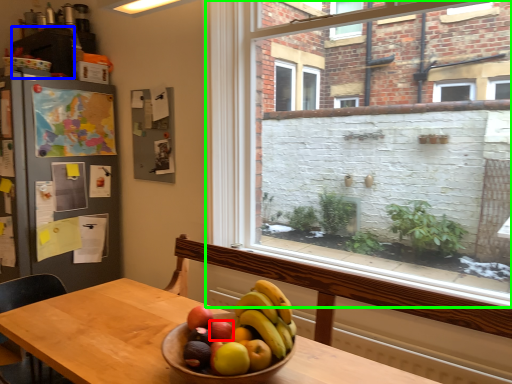
Question: Based on their relative distances, which object is farther from apple (highlighted by a red box)? Choose from cabinetry (highlighted by a blue box) and window (highlighted by a green box).

Choices:
 (A) cabinetry
 (B) window

Answer: (A)